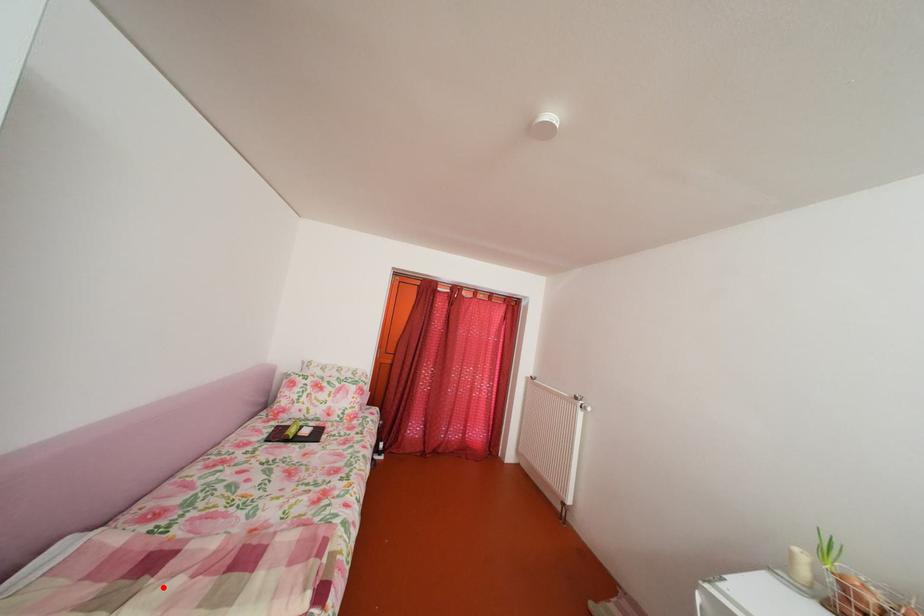
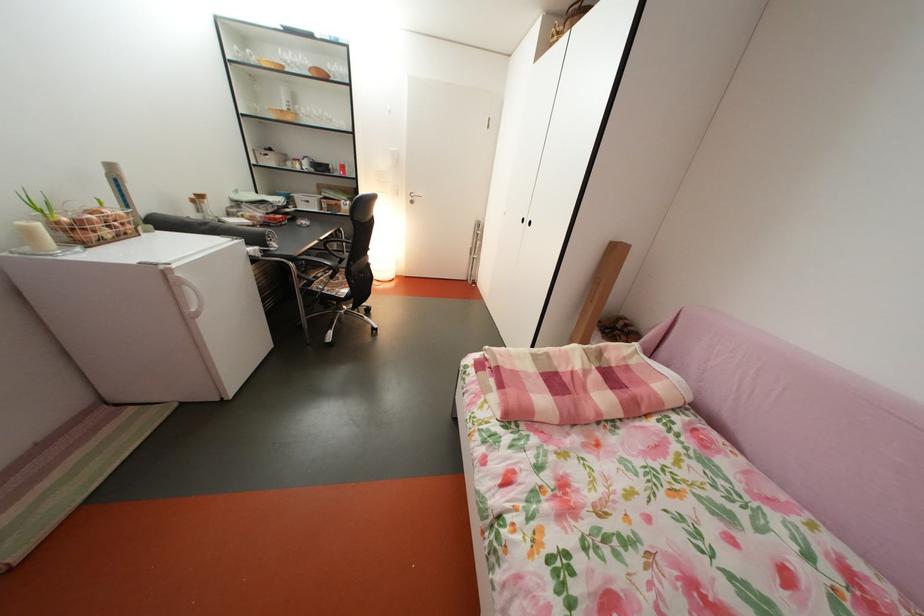
In the second image, find the point that corresponds to the highlighted location in the first image.

(604, 374)